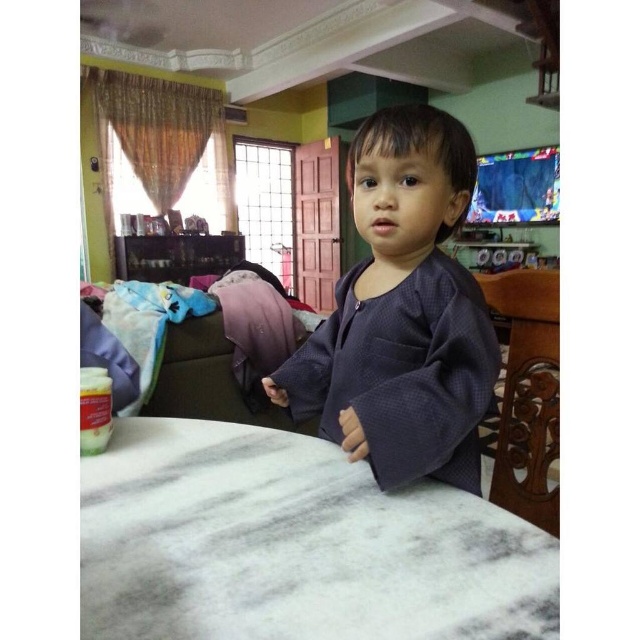
Can you confirm if white marble table at center is wider than dark grey textured robe at center?

Yes.

Which is in front, point (308, 612) or point (337, 381)?

Point (308, 612)

You are a GUI agent. You are given a task and a screenshot of the screen. Output one action in this format:
    pyautogui.click(x=<x>, y=<y>)
    Task: Click on the white marble table at center
    The width and height of the screenshot is (640, 640).
    Given the screenshot: What is the action you would take?
    pyautogui.click(x=292, y=545)

Between white marble table at center and carved wood chair at right, which one is positioned lower?

white marble table at center is below.

Is white marble table at center smaller than carved wood chair at right?

Incorrect, white marble table at center is not smaller in size than carved wood chair at right.

Is point (88, 538) less distant than point (525, 516)?

Yes.

This screenshot has width=640, height=640. Identify the location of white marble table at center. (292, 545).

Is dark grey textured robe at center positioned in front of carved wood chair at right?

Yes.

Is point (419, 326) closer to camera compared to point (524, 419)?

Yes.

Is point (458, 452) positioned in front of point (556, 403)?

That is True.

Identify the location of dark grey textured robe at center. (403, 372).